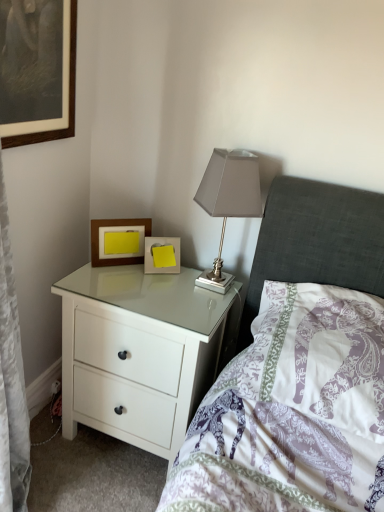
Find the location of a particular element. This screenshot has height=512, width=384. empty space that is ontop of white glossy chest of drawers at center (from a real-world perspective) is located at coordinates (154, 286).